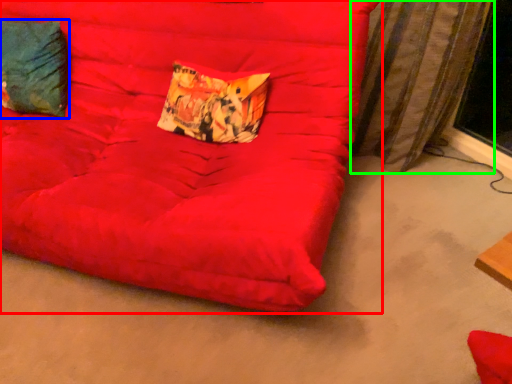
Question: Which object is the farthest from furniture (highlighted by a red box)? Choose among these: pillow (highlighted by a blue box) or curtain (highlighted by a green box).

Choices:
 (A) pillow
 (B) curtain

Answer: (B)